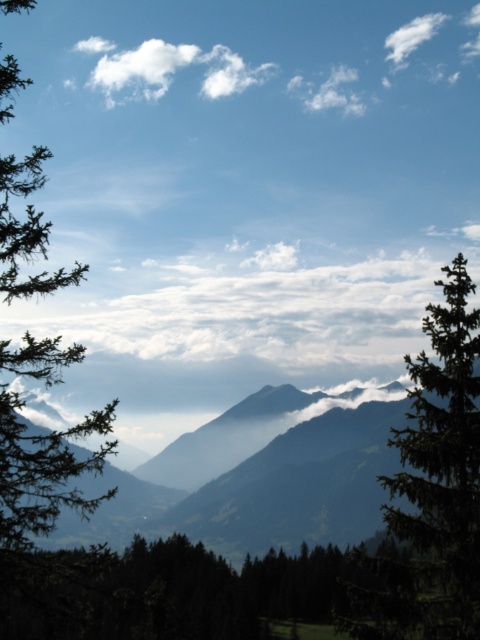
You are standing in the mountain landscape and want to reach the two points marked in the image. Which point, point (236,531) or point (396,51), is closer to you?

Point (236,531) is closer to the viewer than point (396,51).

You are standing at the camera position looking at the green matte tree at left. If you walk straight towards it for 15 meters, will you have reached the tree yet?

The distance between the green matte tree at left and the camera is 16.78 meters. After walking 15 meters towards it, you would still be 1.78 meters away from the tree, so you have not reached it yet.

You are a hiker standing in the valley looking at the green matte tree at left and the white fluffy cloud at upper left. Which object is taller?

The green matte tree at left is taller than the white fluffy cloud at upper left.